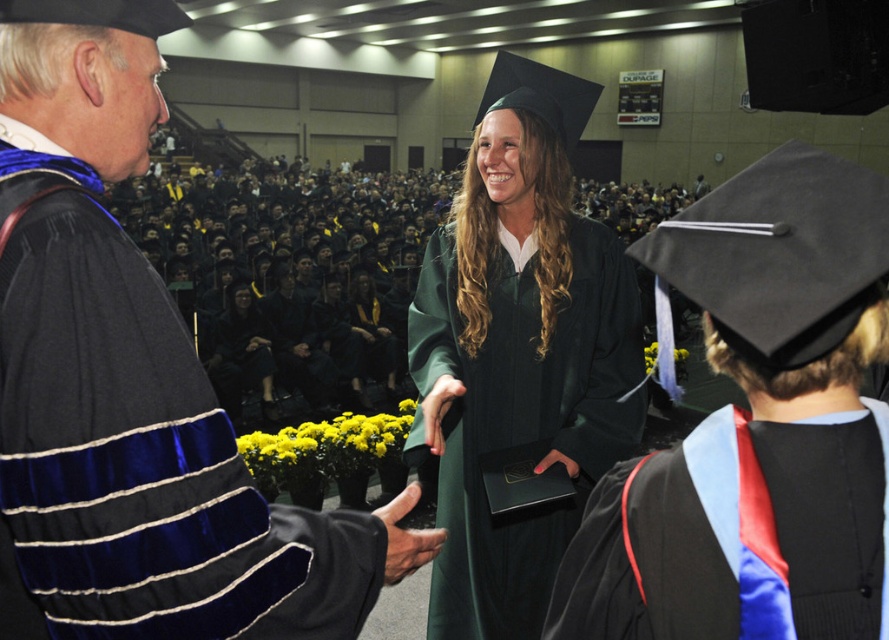
Question: Can you confirm if matte black graduation gown at center is bigger than smooth black glove at center?

Choices:
 (A) yes
 (B) no

Answer: (A)

Question: Can you confirm if green matte graduation gown at center is positioned to the left of smooth black glove at center?

Choices:
 (A) no
 (B) yes

Answer: (A)

Question: Which point is farther from the camera taking this photo?

Choices:
 (A) (621, 326)
 (B) (268, 346)

Answer: (B)

Question: Does velvety black gown at left have a larger size compared to black satin sash at center?

Choices:
 (A) yes
 (B) no

Answer: (A)

Question: Which object is the farthest from the matte black graduation gown at center?

Choices:
 (A) green matte graduation gown at center
 (B) black satin sash at center

Answer: (B)

Question: Which point is farther from the camera taking this photo?

Choices:
 (A) (269, 384)
 (B) (55, 522)
 (C) (833, 620)

Answer: (A)